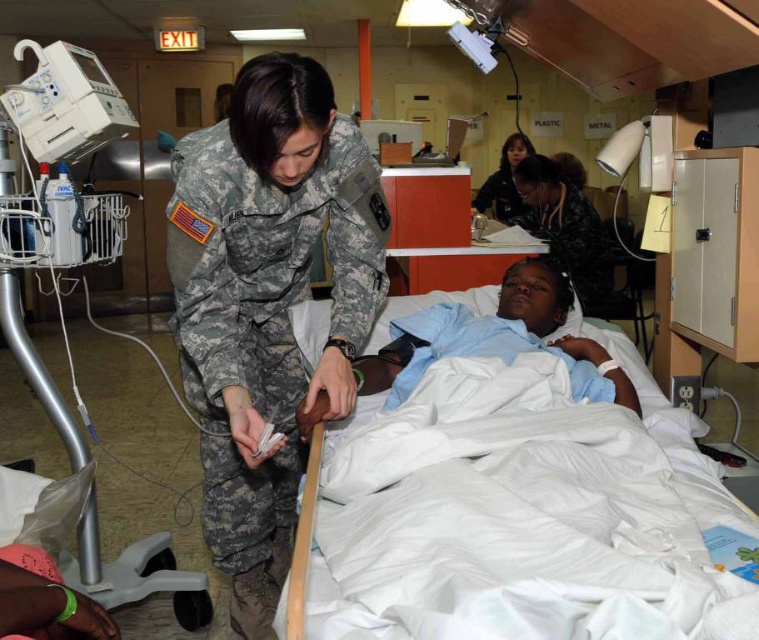
Question: Does white cotton bed at center have a larger size compared to dark blue fabric at center?

Choices:
 (A) yes
 (B) no

Answer: (A)

Question: Which of the following is the farthest from the observer?

Choices:
 (A) (370, 538)
 (B) (373, 296)
 (C) (112, 579)
 (D) (521, 211)

Answer: (D)

Question: Which point appears closest to the camera in this image?

Choices:
 (A) (380, 582)
 (B) (550, 186)
 (C) (263, 342)
 (D) (512, 189)

Answer: (A)

Question: Considering the relative positions of white plastic medical cart at left and dark blue fabric at center in the image provided, where is white plastic medical cart at left located with respect to dark blue fabric at center?

Choices:
 (A) below
 (B) above

Answer: (A)

Question: Considering the relative positions of camouflage fabric uniform at center and dark brown leather jacket at upper center in the image provided, where is camouflage fabric uniform at center located with respect to dark brown leather jacket at upper center?

Choices:
 (A) above
 (B) below

Answer: (B)

Question: Which of the following is the farthest from the observer?

Choices:
 (A) (682, 538)
 (B) (499, 220)

Answer: (B)